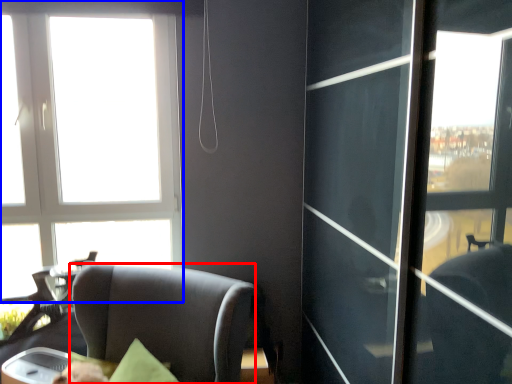
Question: Which object appears farthest to the camera in this image, chair (highlighted by a red box) or window (highlighted by a blue box)?

Choices:
 (A) chair
 (B) window

Answer: (B)